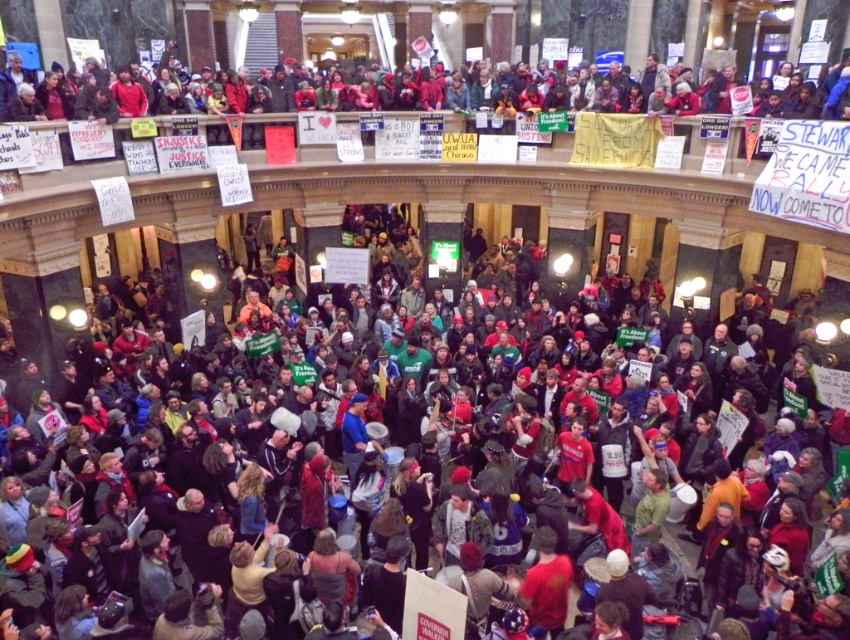
Consider the image. You are a photographer trying to capture the protest scene. You notice the multicolored fabric crowd at center and the red fabric banner at upper center. Which object is located above the other?

The red fabric banner at upper center is above the multicolored fabric crowd at center because the crowd is positioned under the banner.

You are a photographer standing at the entrance of the grand hall. You want to capture the multicolored fabric crowd at center in your photo. Where should you position your camera to ensure the crowd is centered in the frame?

To center the multicolored fabric crowd at center in your photo, position your camera at point [350,403].

You are standing in the grand hall and want to reach the point marked at coordinates [140,444]. Given that the hall is crowded with protesters, do you think you can safely navigate to that point without getting too close to others?

The point at coordinates [140,444] is 46.62 meters away from the viewer. Given the distance and the crowd density, it might be challenging to navigate safely without getting too close to others, but it is possible with caution.